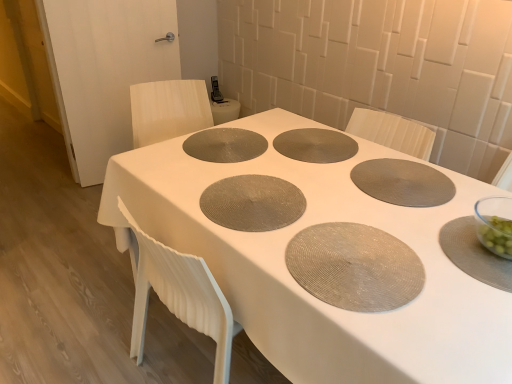
Image resolution: width=512 pixels, height=384 pixels. Find the location of `vacant area situated below matte gray placemat at center, the 2th pizza pan when ordered from left to right (from a real-world perspective)`. vacant area situated below matte gray placemat at center, the 2th pizza pan when ordered from left to right (from a real-world perspective) is located at coordinates (311, 140).